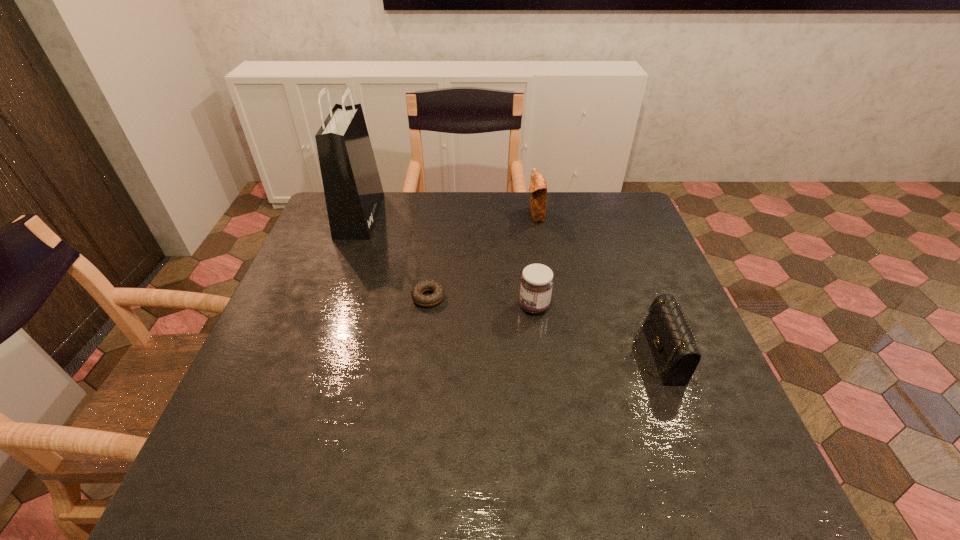
Locate which object is the third closest to the shorter clutch bag. Please provide its 2D coordinates. Your answer should be formatted as a tuple, i.e. [(x, y)], where the tuple contains the x and y coordinates of a point satisfying the conditions above.

[(436, 297)]

I want to click on object that stands as the fourth closest to the shorter clutch bag, so click(353, 191).

Identify the location of vacant point that satisfies the following two spatial constraints: 1. on the back side of the second object from left to right; 2. on the front with handles of the tallest object. This screenshot has height=540, width=960. (439, 215).

You are a GUI agent. You are given a task and a screenshot of the screen. Output one action in this format:
    pyautogui.click(x=<x>, y=<y>)
    Task: Click on the free location that satisfies the following two spatial constraints: 1. on the front with handles of the shopping bag; 2. on the left side of the second object from left to right
    This screenshot has width=960, height=540.
    Given the screenshot: What is the action you would take?
    pyautogui.click(x=330, y=298)

Locate an element on the screen. Image resolution: width=960 pixels, height=540 pixels. vacant region that satisfies the following two spatial constraints: 1. on the front with handles of the shortest object; 2. on the right side of the shopping bag is located at coordinates (330, 298).